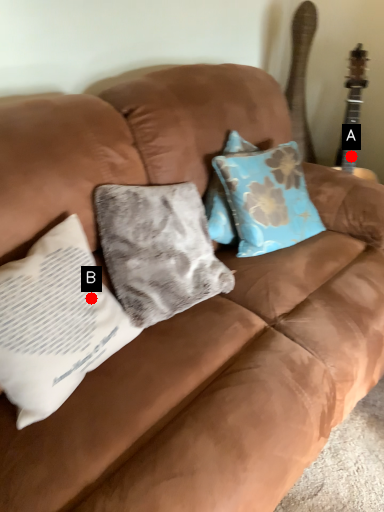
Question: Two points are circled on the image, labeled by A and B beside each circle. Which point is farther to the camera?

Choices:
 (A) A is further
 (B) B is further

Answer: (A)